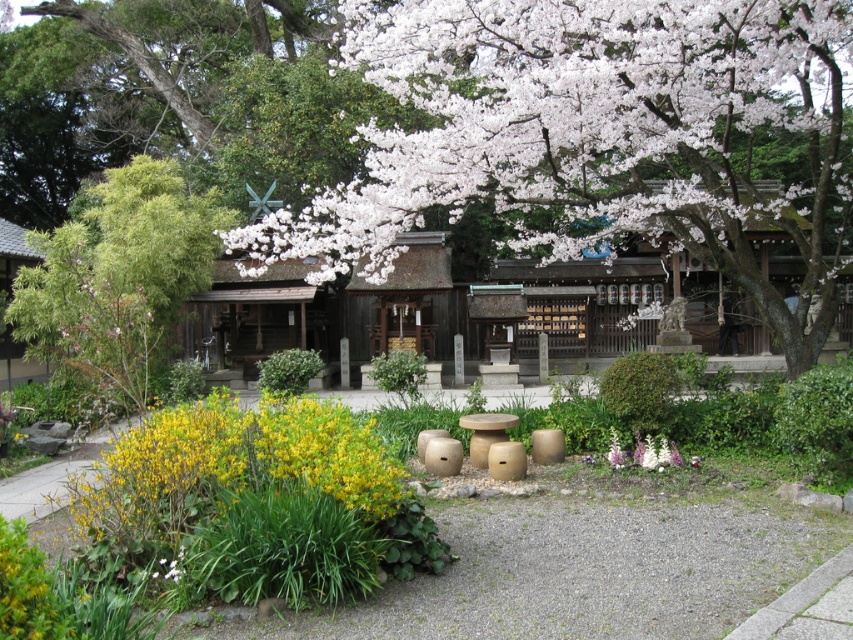
Question: Can you confirm if white matte flowers at lower center is positioned below white matte flower at lower left?

Choices:
 (A) no
 (B) yes

Answer: (A)

Question: Which of the following is the closest to the observer?

Choices:
 (A) (553, 109)
 (B) (210, 477)

Answer: (B)

Question: Which point appears farthest from the camera in this image?

Choices:
 (A) (392, 468)
 (B) (808, 189)
 (C) (608, 452)

Answer: (B)

Question: Which point is closer to the camera?

Choices:
 (A) white petal blossom at center
 (B) yellow matte flowers at lower left

Answer: (B)

Question: Does white petal blossom at center have a lesser width compared to white matte flower at lower left?

Choices:
 (A) no
 (B) yes

Answer: (A)

Question: Is white matte flowers at lower center bigger than white matte flower at lower left?

Choices:
 (A) yes
 (B) no

Answer: (A)